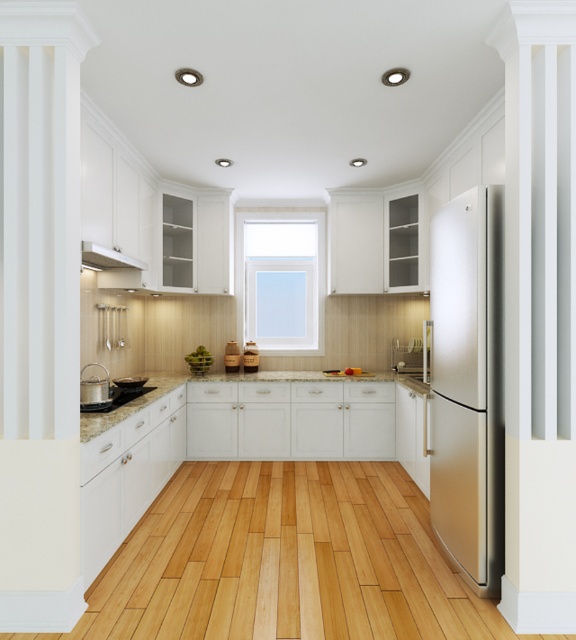
Which is in front, point (452, 244) or point (101, 259)?

Positioned in front is point (452, 244).

Is satin stainless steel refrigerator at right wider than white matte exhaust hood at upper left?

In fact, satin stainless steel refrigerator at right might be narrower than white matte exhaust hood at upper left.

Does point (433, 506) come closer to viewer compared to point (139, 269)?

Yes, point (433, 506) is closer to viewer.

You are a GUI agent. You are given a task and a screenshot of the screen. Output one action in this format:
    pyautogui.click(x=<x>, y=<y>)
    Task: Click on the satin stainless steel refrigerator at right
    
    Given the screenshot: What is the action you would take?
    pyautogui.click(x=468, y=385)

Can you confirm if granite countertop at center is wider than brushed metal sink at lower left?

Yes.

Does point (93, 432) come closer to viewer compared to point (137, 376)?

Yes, it is in front of point (137, 376).

Between point (185, 376) and point (108, 404), which one is positioned in front?

Point (108, 404) is more forward.

The image size is (576, 640). What are the coordinates of `granite countertop at center` in the screenshot? It's located at (175, 387).

Which is more to the left, transparent glass window at center or granite countertop at center?

From the viewer's perspective, granite countertop at center appears more on the left side.

Is point (297, 291) positioned before point (157, 384)?

No.

Who is more distant from viewer, (247, 220) or (146, 401)?

The point (247, 220) is behind.

This screenshot has width=576, height=640. In order to click on transparent glass window at center in this screenshot , I will do `click(281, 280)`.